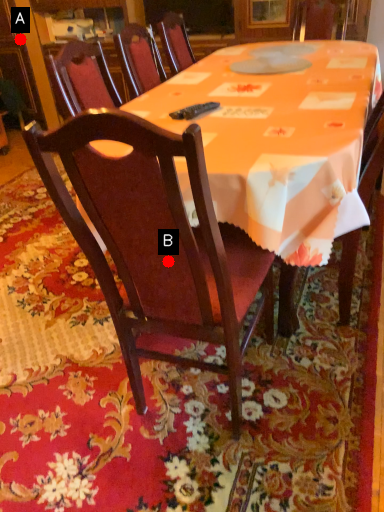
Question: Two points are circled on the image, labeled by A and B beside each circle. Which point is farther from the camera taking this photo?

Choices:
 (A) A is further
 (B) B is further

Answer: (A)